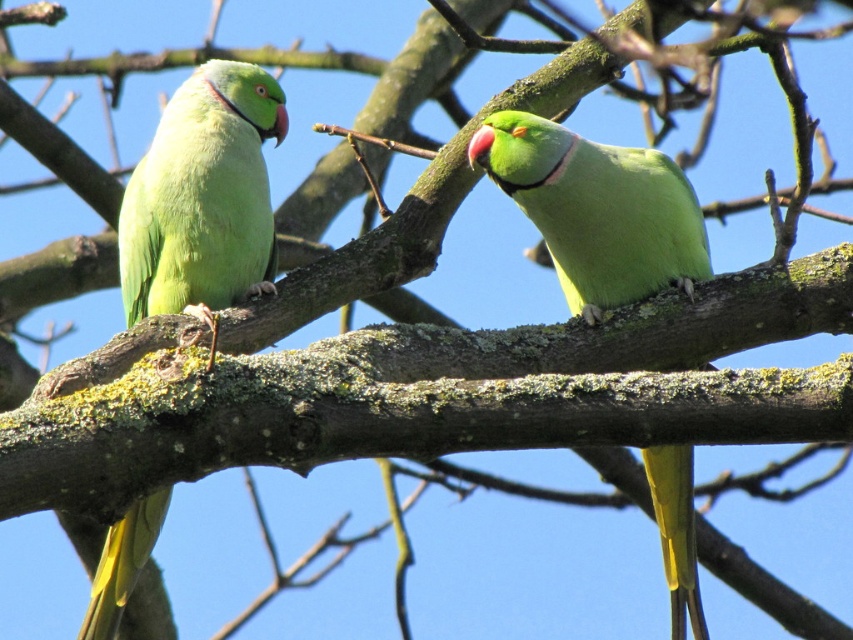
Which is more to the left, matte green parrot at left or green matte parrot at center?

From the viewer's perspective, matte green parrot at left appears more on the left side.

Where is `matte green parrot at left`? The width and height of the screenshot is (853, 640). matte green parrot at left is located at coordinates [x=202, y=198].

Locate an element on the screen. The height and width of the screenshot is (640, 853). matte green parrot at left is located at coordinates (202, 198).